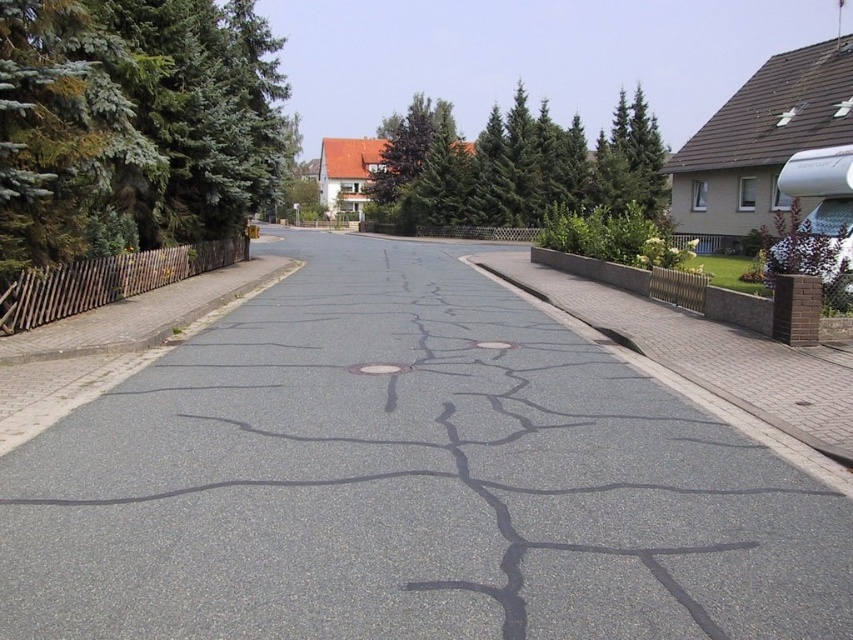
Which is below, green textured pine tree at left or green textured tree at upper center?

green textured pine tree at left is below.

Is point (113, 4) in front of point (607, 196)?

Yes, it is in front of point (607, 196).

At what (x,y) coordinates should I click in order to perform the action: click on green textured pine tree at left. Please return your answer as a coordinate pair (x, y). Looking at the image, I should click on (132, 122).

In the scene shown: Which of these two, gray asphalt road at center or green textured pine tree at left, stands taller?

With more height is green textured pine tree at left.

Does point (676, 401) come closer to viewer compared to point (61, 144)?

Yes, it is in front of point (61, 144).

At what (x,y) coordinates should I click in order to perform the action: click on gray asphalt road at center. Please return your answer as a coordinate pair (x, y). Looking at the image, I should click on (408, 483).

Is green textured pine tree at left shorter than brick at right?

No.

From the picture: Is green textured pine tree at left to the right of brick at right from the viewer's perspective?

Incorrect, green textured pine tree at left is not on the right side of brick at right.

Locate an element on the screen. The height and width of the screenshot is (640, 853). green textured pine tree at left is located at coordinates (132, 122).